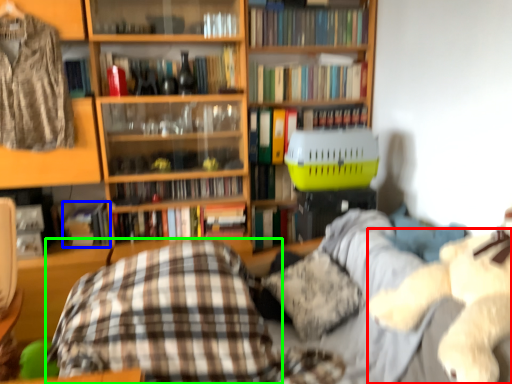
Question: Considering the real-world distances, which object is closest to animal (highlighted by a red box)? book (highlighted by a blue box) or plaid (highlighted by a green box).

Choices:
 (A) book
 (B) plaid

Answer: (B)